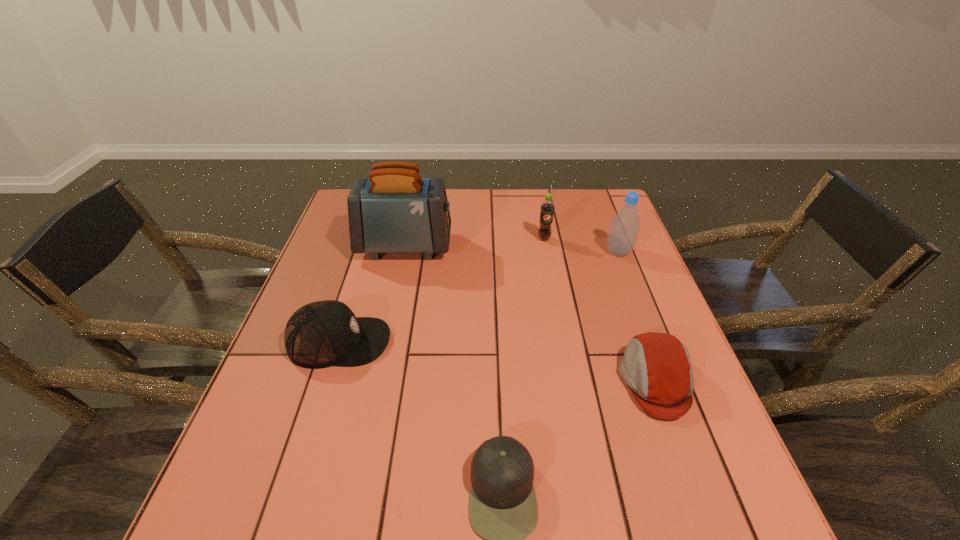
The height and width of the screenshot is (540, 960). I want to click on empty space between the third tallest object and the second tallest object, so click(x=582, y=245).

Locate which object ranks fifth in proximity to the fourth object from right to left. Please provide its 2D coordinates. Your answer should be formatted as a tuple, i.e. [(x, y)], where the tuple contains the x and y coordinates of a point satisfying the conditions above.

[(547, 208)]

Select which object appears as the second closest to the tallest object. Please provide its 2D coordinates. Your answer should be formatted as a tuple, i.e. [(x, y)], where the tuple contains the x and y coordinates of a point satisfying the conditions above.

[(547, 208)]

Locate an element on the screen. The image size is (960, 540). the closest cap to the nearest cap is located at coordinates (656, 367).

Image resolution: width=960 pixels, height=540 pixels. Identify the location of cap object that ranks as the second closest to the soda. (320, 334).

The width and height of the screenshot is (960, 540). In order to click on vacant point that satisfies the following two spatial constraints: 1. on the front label of the third object from right to left; 2. on the front-facing side of the tallest object in this screenshot , I will do `click(545, 246)`.

Locate an element on the screen. vacant space that satisfies the following two spatial constraints: 1. on the front side of the bottle; 2. on the front-facing side of the rightmost cap is located at coordinates (669, 381).

At what (x,y) coordinates should I click in order to perform the action: click on vacant space that satisfies the following two spatial constraints: 1. on the front label of the soda; 2. on the front-facing side of the toaster. Please return your answer as a coordinate pair (x, y). This screenshot has width=960, height=540. Looking at the image, I should click on (545, 246).